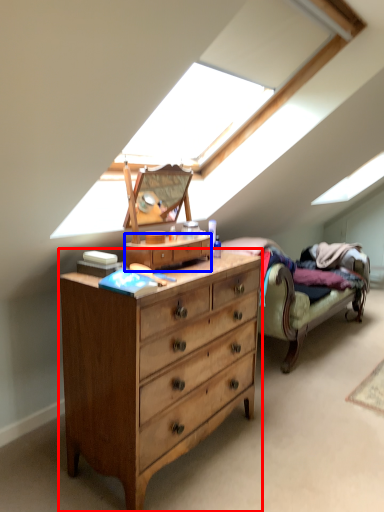
Question: Which point is further to the camera, chest of drawers (highlighted by a red box) or file cabinet (highlighted by a blue box)?

Choices:
 (A) chest of drawers
 (B) file cabinet

Answer: (B)